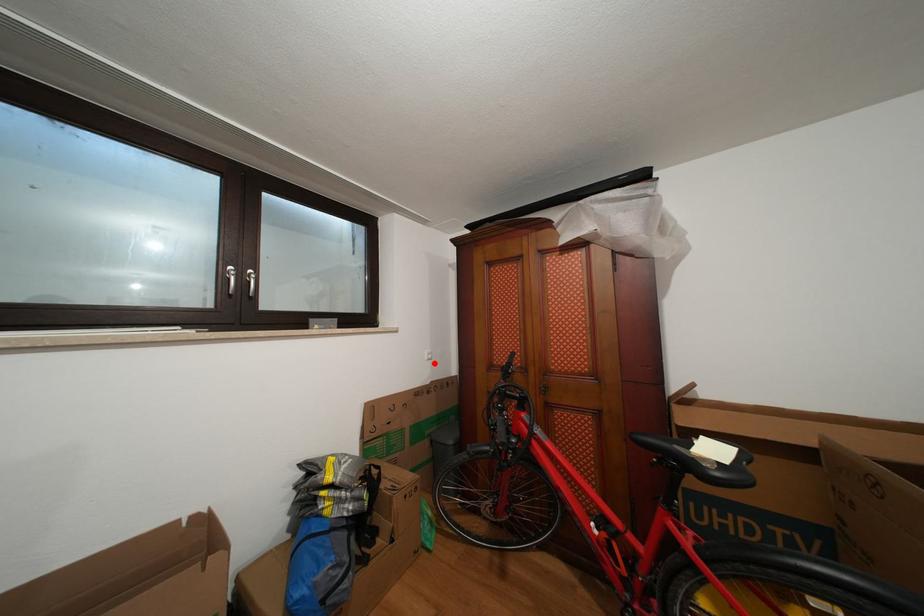
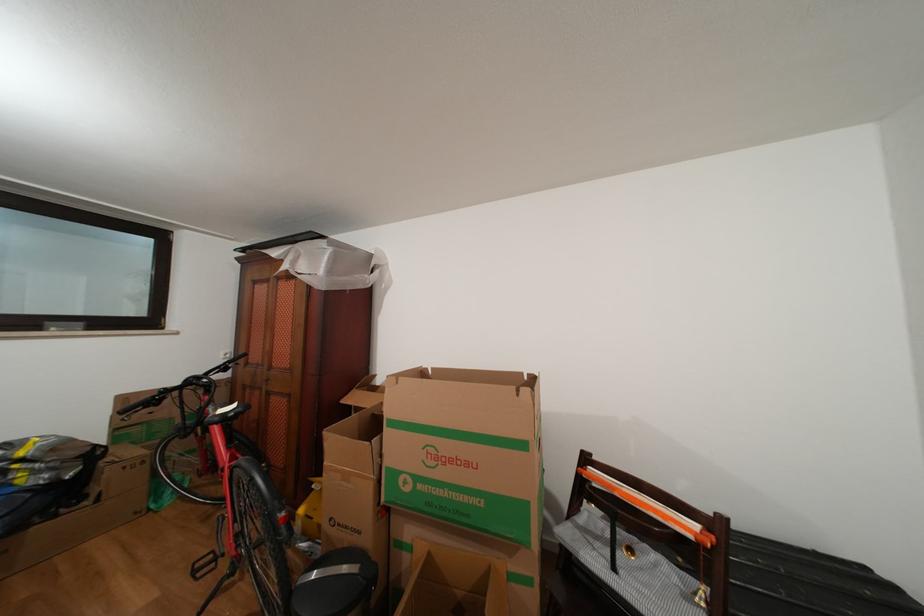
The point at the highlighted location is marked in the first image. Where is the corresponding point in the second image?

(229, 363)